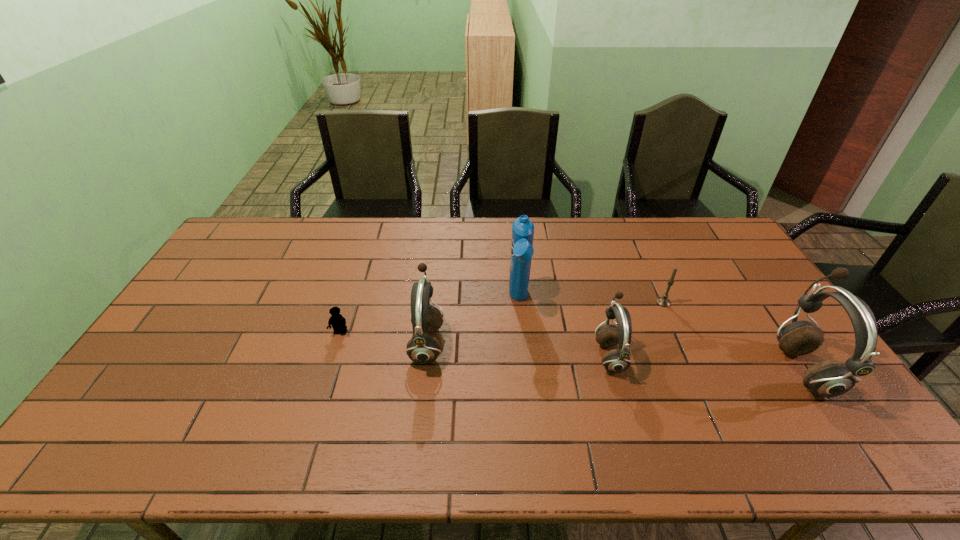
Locate an element on the screen. Image resolution: width=960 pixels, height=540 pixels. free space that is in between the tallest earphone and the fourth object from right to left is located at coordinates (660, 334).

This screenshot has width=960, height=540. Find the location of `empty space between the rightmost earphone and the second object from right to left`. empty space between the rightmost earphone and the second object from right to left is located at coordinates (733, 335).

The height and width of the screenshot is (540, 960). In order to click on vacant point located between the fourth shortest object and the fifth tallest object in this screenshot , I will do `click(545, 322)`.

The image size is (960, 540). What are the coordinates of `unoccupied position between the tallest earphone and the fourth tallest object` in the screenshot? It's located at (707, 362).

Locate an element on the screen. The height and width of the screenshot is (540, 960). free space between the second earphone from left to right and the Lego is located at coordinates (475, 344).

Identify the location of free space that is in between the rightmost object and the fourth object from right to left. coord(660,334).

Identify the location of free space between the third shortest object and the leftmost object. (475, 344).

I want to click on free spot between the tallest earphone and the fourth object from left to right, so click(x=707, y=362).

The image size is (960, 540). I want to click on object that is the second closest to the third shortest object, so pos(662,301).

The height and width of the screenshot is (540, 960). I want to click on object that is the fifth closest one to the second shortest object, so click(337, 321).